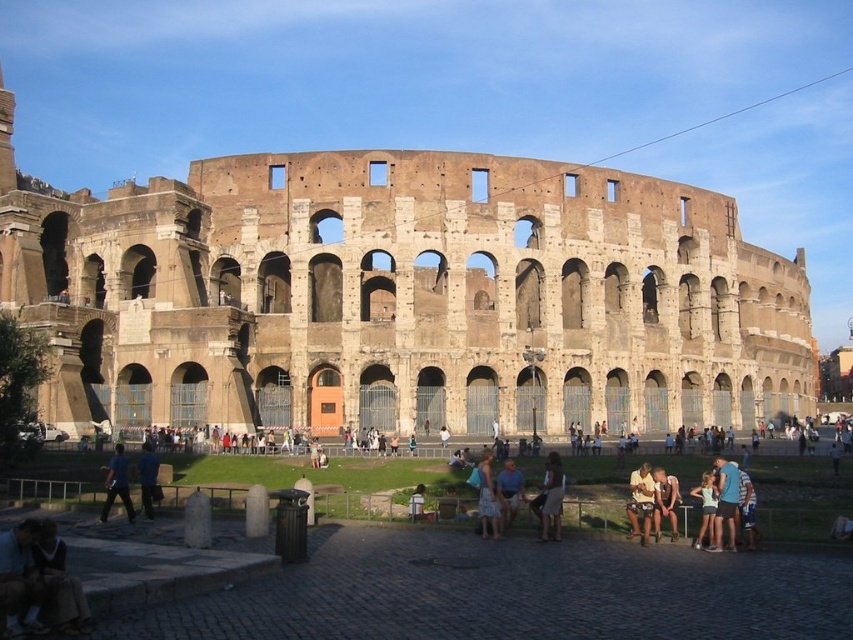
Question: Which object appears closest to the camera in this image?

Choices:
 (A) brown stone amphitheater at center
 (B) patterned fabric dress at center
 (C) light brown fabric dress at lower right

Answer: (C)

Question: Can you confirm if blue denim shorts at lower right is positioned above white cotton shirt at lower right?

Choices:
 (A) yes
 (B) no

Answer: (B)

Question: Which is farther from the white cotton shirt at lower right?

Choices:
 (A) patterned fabric dress at center
 (B) blue fabric shirt at lower left
 (C) light brown fabric dress at lower right
 (D) light blue denim shorts at lower right

Answer: (B)

Question: Observing the image, what is the correct spatial positioning of blue denim jeans at lower left in reference to light blue denim shorts at center?

Choices:
 (A) right
 (B) left

Answer: (B)

Question: Does blue denim shorts at lower right appear over blue denim jeans at lower left?

Choices:
 (A) no
 (B) yes

Answer: (A)

Question: Which of these objects is positioned closest to the light brown leather jacket at lower right?

Choices:
 (A) white cotton shirt at lower right
 (B) blue fabric shirt at lower left
 (C) light brown fabric dress at lower right
 (D) brown stone amphitheater at center

Answer: (A)